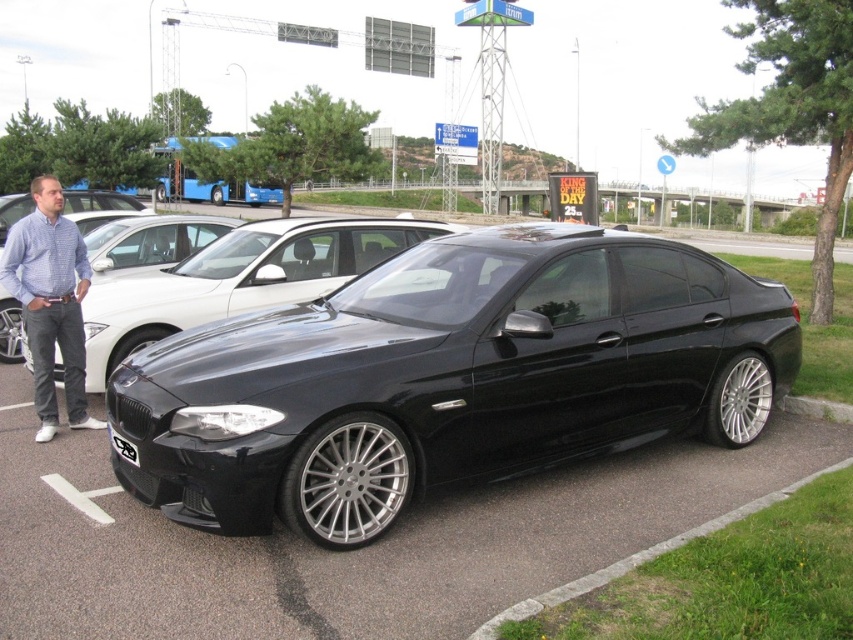
Question: From the image, what is the correct spatial relationship of glossy black car at center in relation to glossy black sedan at center?

Choices:
 (A) below
 (B) above

Answer: (A)

Question: Which point is farther to the camera?

Choices:
 (A) blue checkered shirt at left
 (B) black plastic license plate at center
 (C) glossy black sedan at center
 (D) glossy black car at center

Answer: (C)

Question: Which point is closer to the camera?

Choices:
 (A) 25,292
 (B) 106,284
 (C) 360,381
 (D) 113,442

Answer: (C)

Question: Can you confirm if glossy black car at center is positioned above black plastic license plate at center?

Choices:
 (A) no
 (B) yes

Answer: (B)

Question: Which point is farther to the camera?

Choices:
 (A) glossy black car at center
 (B) black plastic license plate at center

Answer: (B)

Question: Considering the relative positions of glossy black car at center and glossy black sedan at center in the image provided, where is glossy black car at center located with respect to glossy black sedan at center?

Choices:
 (A) below
 (B) above

Answer: (A)